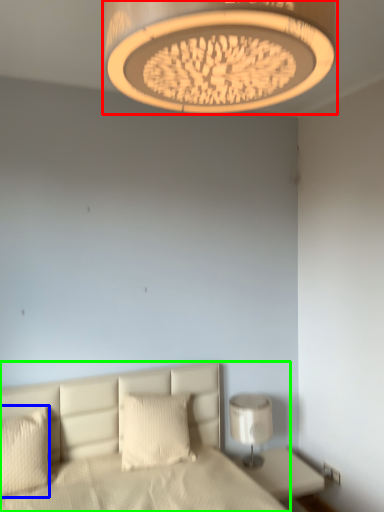
Question: Which object is the closest to the lamp (highlighted by a red box)? Choose among these: pillow (highlighted by a blue box) or bed (highlighted by a green box).

Choices:
 (A) pillow
 (B) bed

Answer: (B)